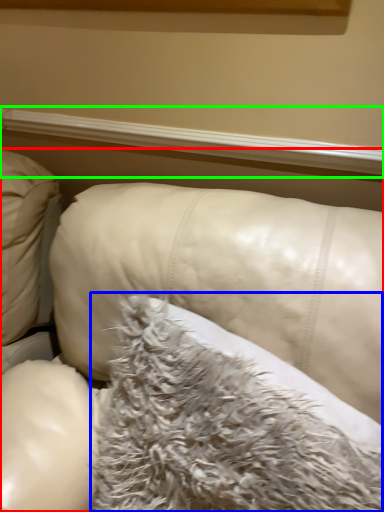
Question: Based on their relative distances, which object is farther from furniture (highlighted by a red box)? Choose from pillow (highlighted by a blue box) and window sill (highlighted by a green box).

Choices:
 (A) pillow
 (B) window sill

Answer: (B)